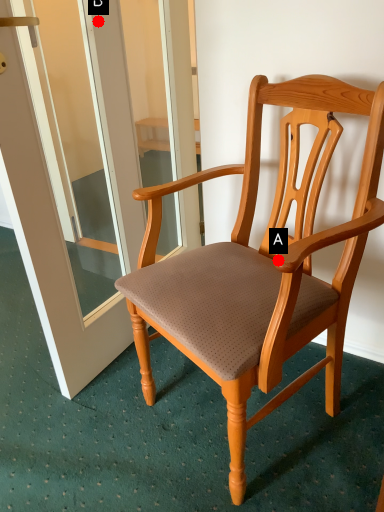
Question: Two points are circled on the image, labeled by A and B beside each circle. Which point is closer to the camera?

Choices:
 (A) A is closer
 (B) B is closer

Answer: (A)